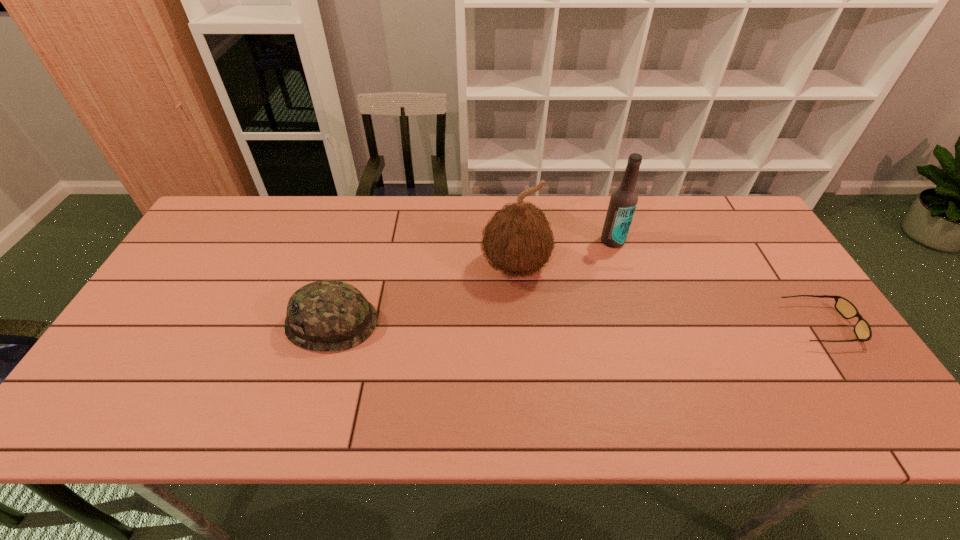
At what (x,y) coordinates should I click in order to perform the action: click on headwear. Please return your answer as a coordinate pair (x, y). Looking at the image, I should click on (329, 315).

At what (x,y) coordinates should I click in order to perform the action: click on the third tallest object. Please return your answer as a coordinate pair (x, y). Image resolution: width=960 pixels, height=540 pixels. Looking at the image, I should click on (329, 315).

In order to click on the rightmost object in this screenshot , I will do `click(862, 329)`.

Where is `sunglasses`? Image resolution: width=960 pixels, height=540 pixels. sunglasses is located at coordinates (862, 329).

Identify the location of beer bottle. The height and width of the screenshot is (540, 960). (623, 201).

In order to click on coconut in this screenshot , I will do `click(518, 239)`.

Locate an element on the screen. vacant space located 0.120m on the back of the headwear is located at coordinates (349, 264).

This screenshot has height=540, width=960. I want to click on free space located on the side of the beer bottle with the label, so click(x=588, y=288).

Locate an element on the screen. vacant region located 0.050m on the side of the beer bottle with the label is located at coordinates (604, 258).

Where is `blank space located on the side of the beer bottle with the label`? The width and height of the screenshot is (960, 540). blank space located on the side of the beer bottle with the label is located at coordinates (563, 334).